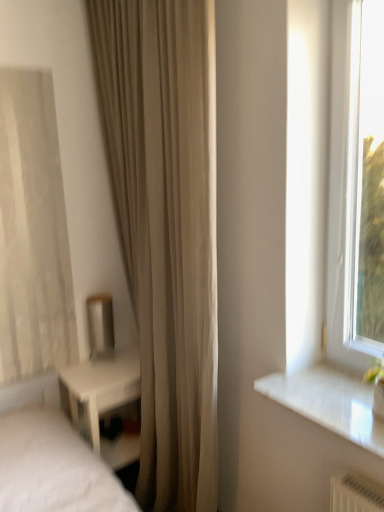
Question: Does beige fabric curtain at center have a greater height compared to white glossy nightstand at lower left?

Choices:
 (A) yes
 (B) no

Answer: (A)

Question: Is beige fabric curtain at center far away from white glossy nightstand at lower left?

Choices:
 (A) yes
 (B) no

Answer: (B)

Question: Does beige fabric curtain at center come in front of white glossy nightstand at lower left?

Choices:
 (A) yes
 (B) no

Answer: (A)

Question: Is beige fabric curtain at center facing towards white glossy nightstand at lower left?

Choices:
 (A) yes
 (B) no

Answer: (A)

Question: Is beige fabric curtain at center further to camera compared to white glossy nightstand at lower left?

Choices:
 (A) yes
 (B) no

Answer: (B)

Question: Can you confirm if beige fabric curtain at center is thinner than white glossy nightstand at lower left?

Choices:
 (A) yes
 (B) no

Answer: (A)

Question: Can you confirm if white glossy nightstand at lower left is smaller than beige fabric curtain at center?

Choices:
 (A) yes
 (B) no

Answer: (A)

Question: Does white glossy nightstand at lower left have a lesser width compared to beige fabric curtain at center?

Choices:
 (A) yes
 (B) no

Answer: (B)

Question: From a real-world perspective, is white glossy nightstand at lower left on beige fabric curtain at center?

Choices:
 (A) no
 (B) yes

Answer: (A)

Question: Is white glossy nightstand at lower left placed right next to beige fabric curtain at center?

Choices:
 (A) yes
 (B) no

Answer: (B)

Question: Is white glossy nightstand at lower left shorter than beige fabric curtain at center?

Choices:
 (A) no
 (B) yes

Answer: (B)

Question: From a real-world perspective, is white glossy nightstand at lower left beneath beige fabric curtain at center?

Choices:
 (A) yes
 (B) no

Answer: (A)

Question: Is white glossy nightstand at lower left to the left or to the right of beige fabric curtain at center in the image?

Choices:
 (A) right
 (B) left

Answer: (B)